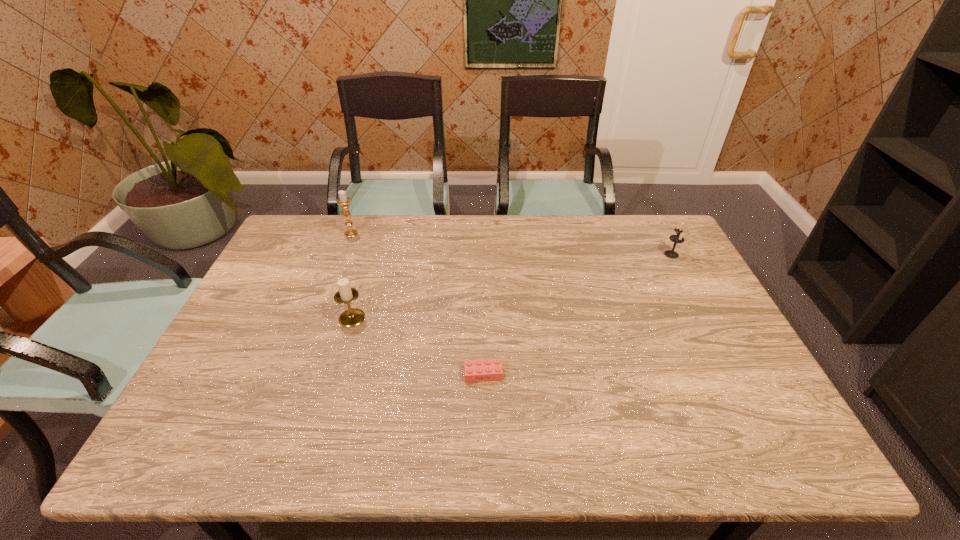
The height and width of the screenshot is (540, 960). Identify the location of blank space located on the front of the rightmost object. (715, 337).

I want to click on free region located 0.370m on the right of the nearest object, so click(x=657, y=374).

At what (x,y) coordinates should I click in order to perform the action: click on object that is at the right edge. Please return your answer as a coordinate pair (x, y). Looking at the image, I should click on (678, 238).

Where is `object that is at the far right corner`? This screenshot has width=960, height=540. object that is at the far right corner is located at coordinates (678, 238).

The width and height of the screenshot is (960, 540). In the image, there is a desktop. Identify the location of vacant space at the far edge. (443, 248).

Where is `vacant region at the near edge`? Image resolution: width=960 pixels, height=540 pixels. vacant region at the near edge is located at coordinates (411, 451).

The height and width of the screenshot is (540, 960). In the image, there is a desktop. Identify the location of free region at the left edge. (292, 279).

The image size is (960, 540). In the image, there is a desktop. In order to click on vacant space at the right edge in this screenshot , I will do pyautogui.click(x=740, y=399).

Where is `blank area at the far left corner`? blank area at the far left corner is located at coordinates (315, 240).

This screenshot has width=960, height=540. What are the coordinates of `free region at the far right corner of the desktop` in the screenshot? It's located at (632, 228).